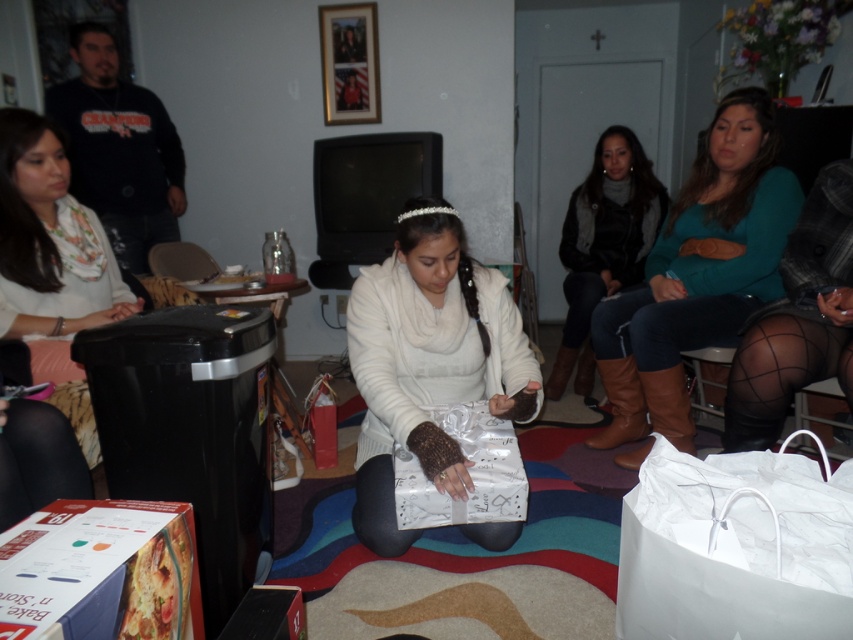
You are standing in the living room where the gift opening is happening. You need to place a small gift under the white knitted sweater at center and the dark brown leather boots at center right. Which object should you place it closer to to ensure it is under both?

You should place the small gift closer to the white knitted sweater at center because it is nearer to the viewer than the dark brown leather boots at center right, so positioning it near the sweater ensures it is under both objects.

You are organizing a charity clothing drive and need to determine which sweater can fit into a donation box that has a minimum width requirement of 30 cm. The white knitted sweater at center and the teal sweater at upper right are both candidates. Based on their sizes, which sweater is more likely to meet the requirement?

The teal sweater at upper right is more likely to meet the minimum width requirement of 30 cm since its width is greater than the white knitted sweater at center.

You are at a party and want to grab a gift for someone. You see a white paper bag at lower right and a white glossy shopping bag at center. Which bag is easier to reach without moving your current position?

The white paper bag at lower right is closer to the viewer, so it is easier to reach without moving from your current position.